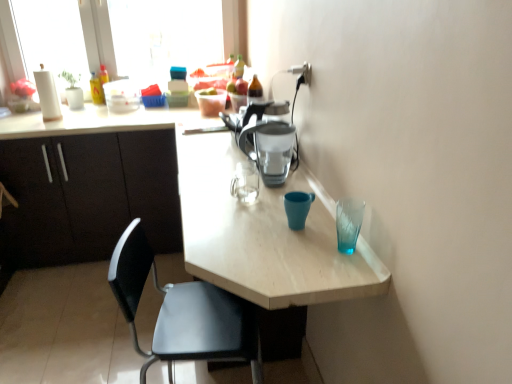
Find the location of `free space above black plastic chair at lower left (from a real-world perspective)`. free space above black plastic chair at lower left (from a real-world perspective) is located at coordinates (218, 234).